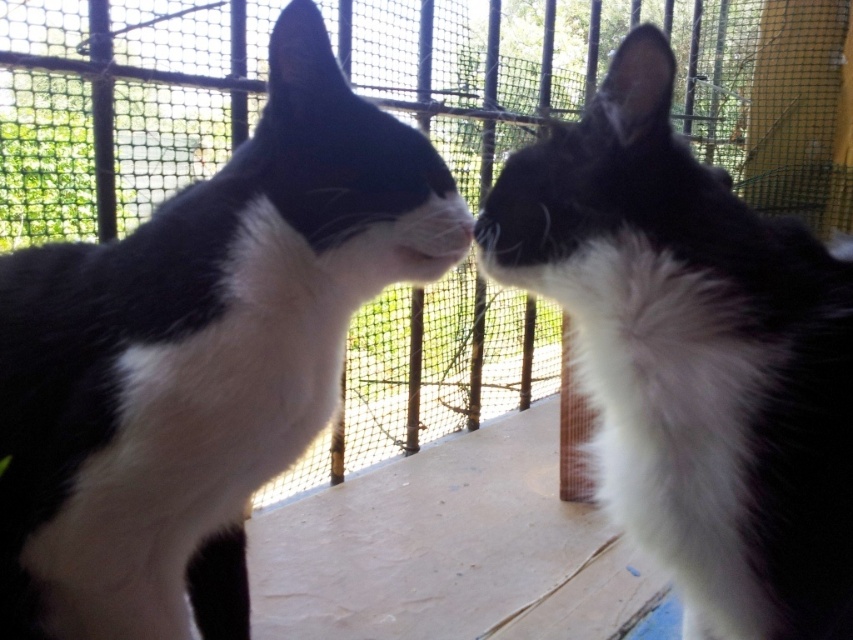
Question: Among these objects, which one is nearest to the camera?

Choices:
 (A) black and white fur cat at left
 (B) black and white fur at center

Answer: (B)

Question: Can you confirm if black and white fur cat at left is positioned below black and white fur at center?

Choices:
 (A) yes
 (B) no

Answer: (B)

Question: Where is black and white fur cat at left located in relation to black and white fur at center in the image?

Choices:
 (A) right
 (B) left

Answer: (B)

Question: Which point is farther from the camera taking this photo?

Choices:
 (A) (0, 636)
 (B) (590, 113)

Answer: (A)

Question: Does black and white fur cat at left have a smaller size compared to black and white fur at center?

Choices:
 (A) no
 (B) yes

Answer: (A)